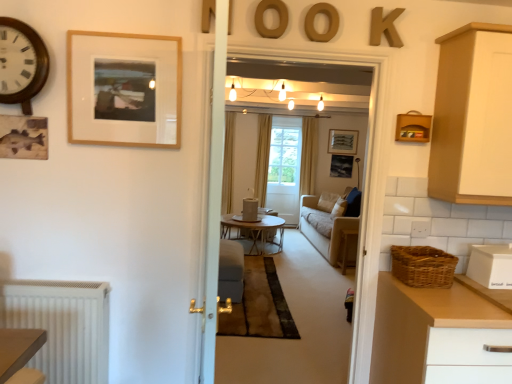
Question: Considering the positions of wooden picture frame at upper left, positioned as the 1th picture frame in left-to-right order, and white matte container at right in the image, is wooden picture frame at upper left, positioned as the 1th picture frame in left-to-right order, bigger or smaller than white matte container at right?

Choices:
 (A) small
 (B) big

Answer: (A)

Question: Considering their positions, is wooden picture frame at upper left, positioned as the 1th picture frame in left-to-right order, located in front of or behind white matte container at right?

Choices:
 (A) front
 (B) behind

Answer: (B)

Question: Which of these objects is positioned closest to the brown matte letter o at upper center, which is the second letter from right to left?

Choices:
 (A) wooden round coffee table at center
 (B) matte black picture frame at center, the 2th picture frame in the right-to-left sequence
 (C) suede gray armchair at center
 (D) white wood cabinet at right
 (E) light gray fabric couch at center

Answer: (D)

Question: Estimate the real-world distances between objects in this image. Which object is closer to the woven basket at right?

Choices:
 (A) brown matte letter o at upper center, which is the second letter from right to left
 (B) white wooden door at center
 (C) white matte chest of drawers at right
 (D) wooden letter at upper center, positioned as the 4th letter in right-to-left order
 (E) woven brown basket at right

Answer: (C)